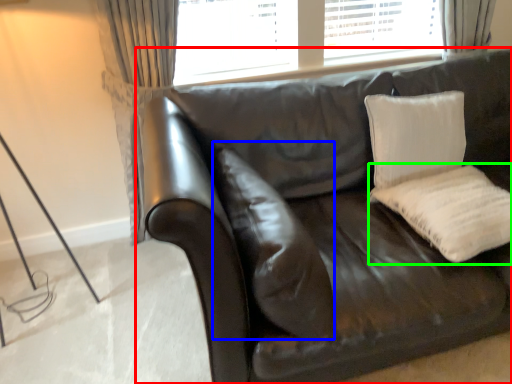
Question: Considering the real-world distances, which object is closest to studio couch (highlighted by a red box)? pillow (highlighted by a blue box) or pillow (highlighted by a green box).

Choices:
 (A) pillow
 (B) pillow

Answer: (A)